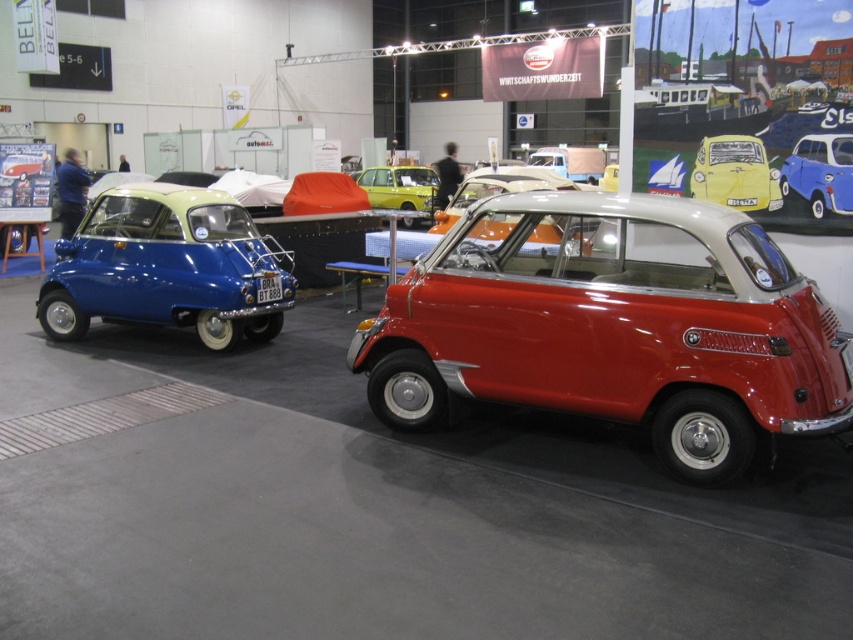
Question: Observing the image, what is the correct spatial positioning of metallic red car at center in reference to yellow matte car at upper right?

Choices:
 (A) right
 (B) left

Answer: (B)

Question: Which point is farther to the camera?

Choices:
 (A) metallic silver car at center
 (B) metallic yellow car at center

Answer: (B)

Question: Which object is closer to the camera taking this photo?

Choices:
 (A) yellow matte car at upper right
 (B) metallic red car at center
 (C) matte blue car at left
 (D) metallic yellow car at center

Answer: (B)

Question: Is metallic red car at center positioned behind yellow matte car at upper right?

Choices:
 (A) yes
 (B) no

Answer: (B)

Question: Which object is closer to the camera taking this photo?

Choices:
 (A) yellow matte car at upper right
 (B) metallic silver car at center
 (C) metallic yellow car at center

Answer: (B)

Question: Does metallic silver car at center appear on the right side of metallic yellow car at center?

Choices:
 (A) no
 (B) yes

Answer: (B)